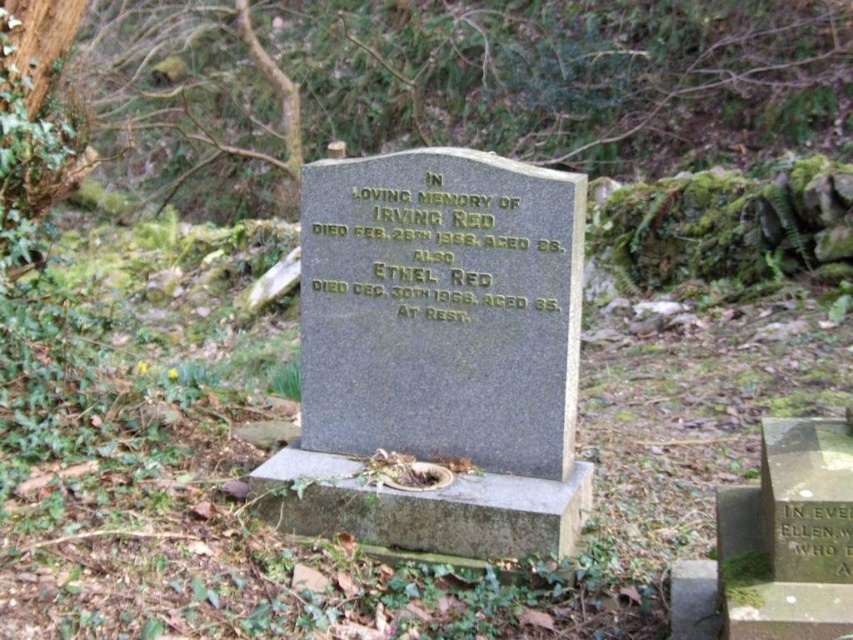
Question: Is goldmaterial/textureinscription at center in front of black stone inscription at lower right?

Choices:
 (A) yes
 (B) no

Answer: (B)

Question: Does goldmaterial/textureinscription at center appear on the left side of black stone inscription at lower right?

Choices:
 (A) yes
 (B) no

Answer: (A)

Question: Is goldmaterial/textureinscription at center to the left of black stone inscription at lower right from the viewer's perspective?

Choices:
 (A) no
 (B) yes

Answer: (B)

Question: Which object appears closest to the camera in this image?

Choices:
 (A) goldmaterial/textureinscription at center
 (B) black stone inscription at lower right

Answer: (B)